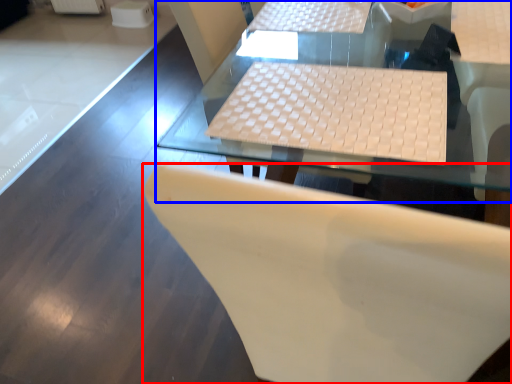
Question: Which of the following is the closest to the observer, chair (highlighted by a red box) or table (highlighted by a blue box)?

Choices:
 (A) chair
 (B) table

Answer: (A)